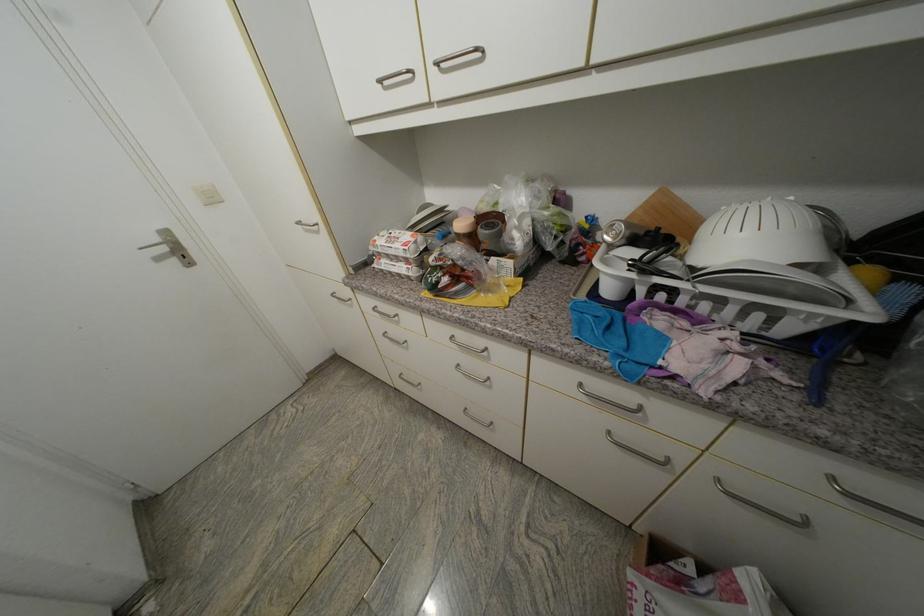
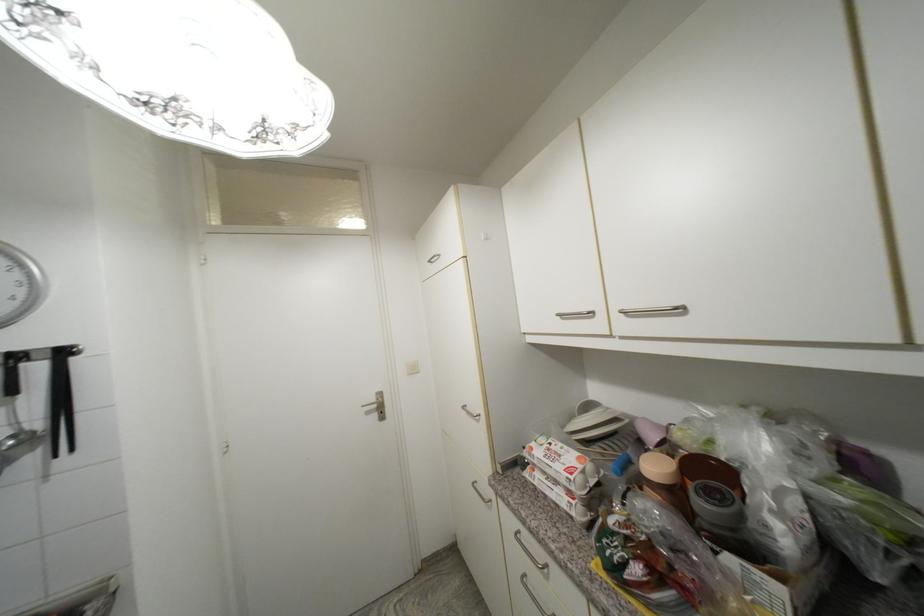
Where in the second image is the point corresponding to (x=164, y=243) from the first image?

(380, 400)